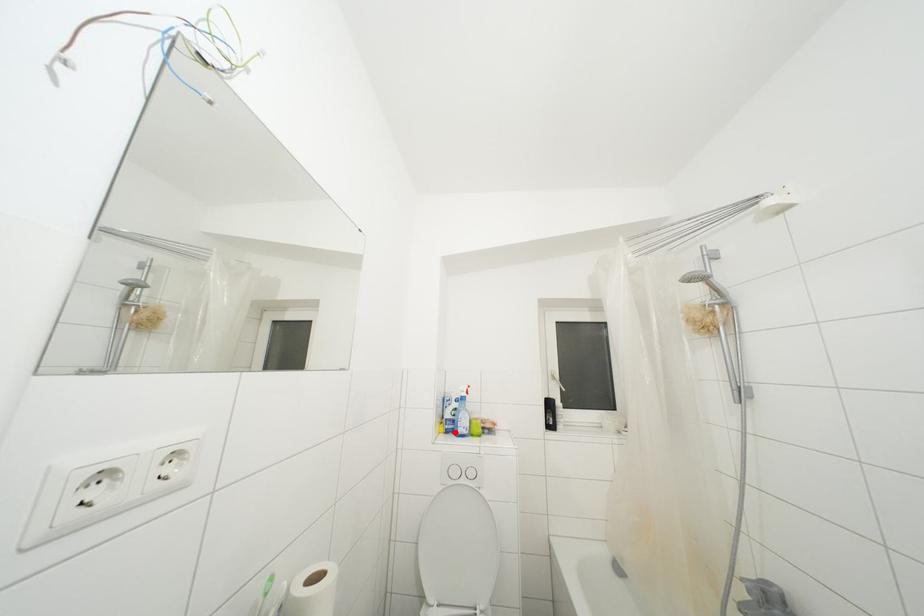
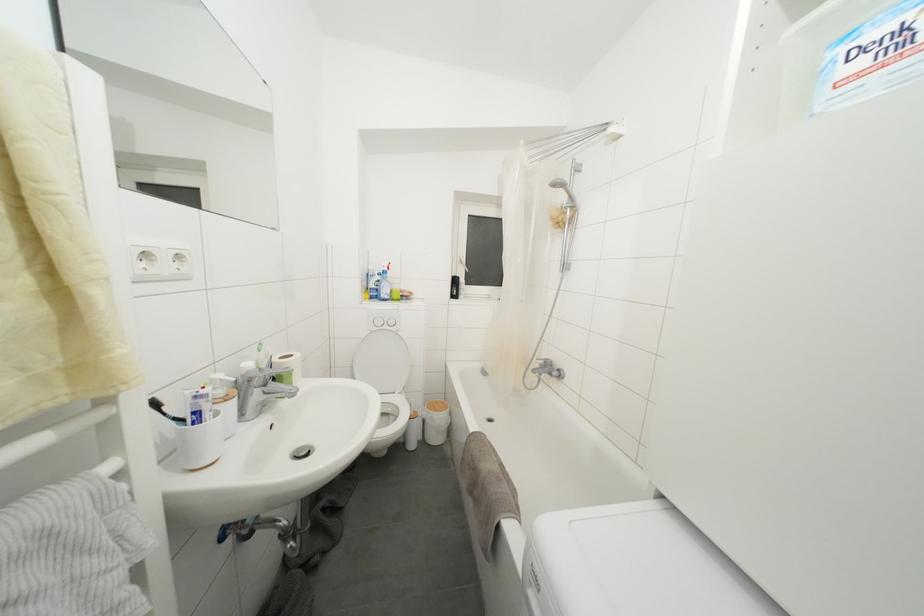
Locate, in the second image, the point that corresponds to the highlighted location in the first image.

(379, 300)